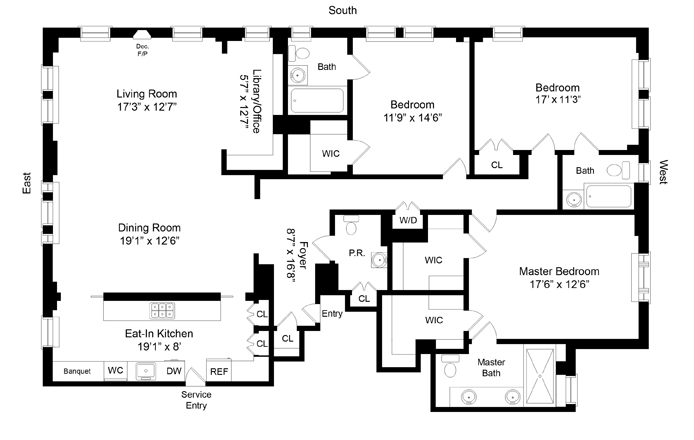
Identify the location of bedroom. (564, 77).